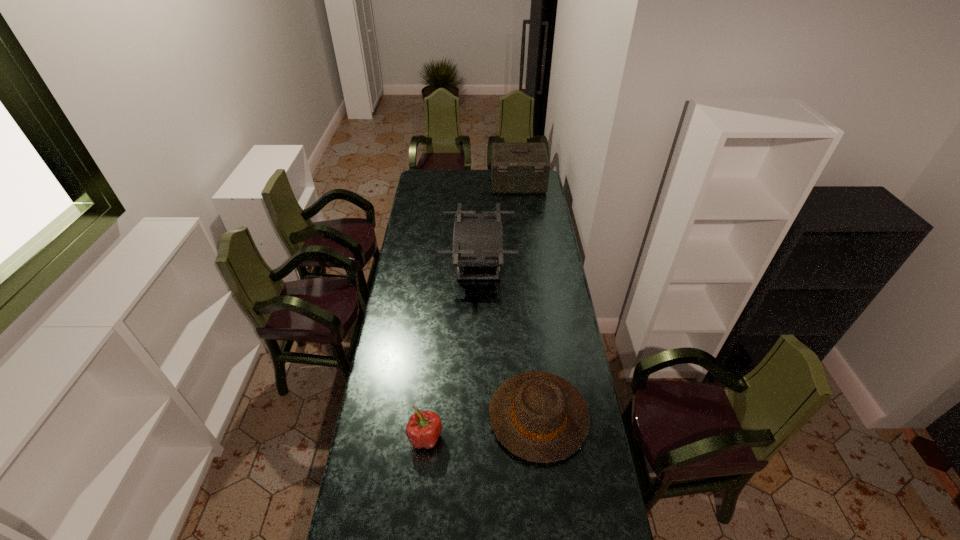
The image size is (960, 540). Identify the location of vacant space in between the farthest object and the bell pepper. (471, 310).

Where is `vacant region between the drone and the cowboy hat`? The image size is (960, 540). vacant region between the drone and the cowboy hat is located at coordinates (509, 339).

Where is `vacant space that is in between the third shortest object and the cowboy hat`? The height and width of the screenshot is (540, 960). vacant space that is in between the third shortest object and the cowboy hat is located at coordinates point(509,339).

This screenshot has height=540, width=960. What are the coordinates of `vacant space that is in between the bell pepper and the cowboy hat` in the screenshot? It's located at (482, 427).

Image resolution: width=960 pixels, height=540 pixels. Find the location of `free spot between the cowboy hat and the first-aid kit`. free spot between the cowboy hat and the first-aid kit is located at coordinates (528, 300).

Locate an element on the screen. This screenshot has width=960, height=540. object that ranks as the second closest to the cowboy hat is located at coordinates (477, 238).

Identify which object is the closest to the cowboy hat. Please provide its 2D coordinates. Your answer should be formatted as a tuple, i.e. [(x, y)], where the tuple contains the x and y coordinates of a point satisfying the conditions above.

[(424, 427)]

You are a GUI agent. You are given a task and a screenshot of the screen. Output one action in this format:
    pyautogui.click(x=<x>, y=<y>)
    Task: Click on the free space that satisfies the following two spatial constraints: 1. with a camera mounted on the underside of the drone; 2. on the front side of the bell pepper
    The height and width of the screenshot is (540, 960).
    Given the screenshot: What is the action you would take?
    pyautogui.click(x=478, y=437)

Find the location of a particular element. This screenshot has height=540, width=960. free space in the image that satisfies the following two spatial constraints: 1. on the front side of the farthest object; 2. with a camera mounted on the underside of the second tallest object is located at coordinates (528, 262).

The image size is (960, 540). In order to click on free space that satisfies the following two spatial constraints: 1. with a camera mounted on the underside of the cowboy hat; 2. on the right side of the drone in this screenshot , I will do `click(478, 416)`.